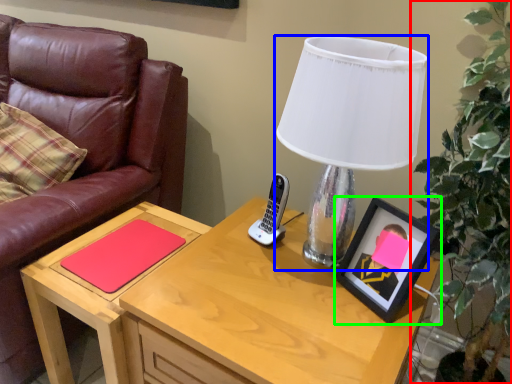
Question: Which object is the closest to the houseplant (highlighted by a red box)? Choose among these: lamp (highlighted by a blue box) or picture frame (highlighted by a green box).

Choices:
 (A) lamp
 (B) picture frame

Answer: (B)